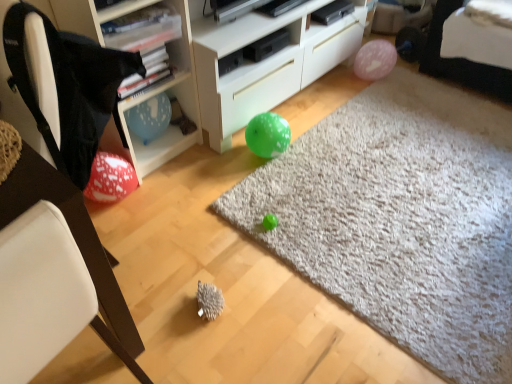
Where is `free space in front of pink matte balloon at upper right`? free space in front of pink matte balloon at upper right is located at coordinates (381, 90).